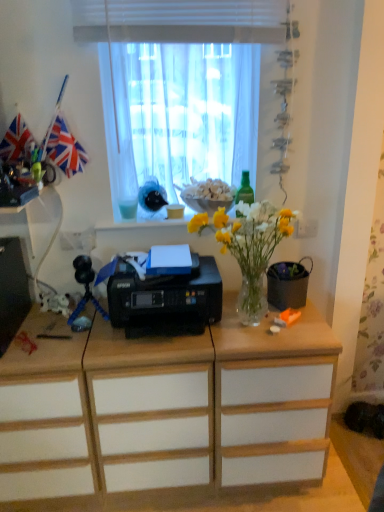
Image resolution: width=384 pixels, height=512 pixels. I want to click on vacant area situated below translucent glass vase at center (from a real-world perspective), so click(253, 325).